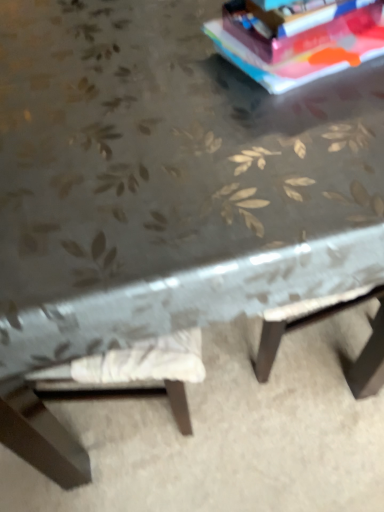
Question: From the image's perspective, is matte paper at upper right under white fabric cushion at lower left?

Choices:
 (A) yes
 (B) no

Answer: (B)

Question: Is matte paper at upper right smaller than white fabric cushion at lower left?

Choices:
 (A) no
 (B) yes

Answer: (B)

Question: Does matte paper at upper right lie in front of white fabric cushion at lower left?

Choices:
 (A) yes
 (B) no

Answer: (A)

Question: Does matte paper at upper right turn towards white fabric cushion at lower left?

Choices:
 (A) no
 (B) yes

Answer: (A)

Question: Considering the relative sizes of matte paper at upper right and white fabric cushion at lower left in the image provided, is matte paper at upper right taller than white fabric cushion at lower left?

Choices:
 (A) no
 (B) yes

Answer: (B)

Question: Considering the relative positions of matte paper at upper right and white fabric cushion at lower left in the image provided, is matte paper at upper right behind white fabric cushion at lower left?

Choices:
 (A) yes
 (B) no

Answer: (B)

Question: Is white fabric cushion at lower left wider than matte paper at upper right?

Choices:
 (A) yes
 (B) no

Answer: (A)

Question: Does white fabric cushion at lower left appear on the right side of matte paper at upper right?

Choices:
 (A) yes
 (B) no

Answer: (B)

Question: Does white fabric cushion at lower left have a smaller size compared to matte paper at upper right?

Choices:
 (A) no
 (B) yes

Answer: (A)

Question: Are white fabric cushion at lower left and matte paper at upper right beside each other?

Choices:
 (A) no
 (B) yes

Answer: (A)

Question: Is white fabric cushion at lower left to the left of matte paper at upper right from the viewer's perspective?

Choices:
 (A) yes
 (B) no

Answer: (A)

Question: Does white fabric cushion at lower left lie behind matte paper at upper right?

Choices:
 (A) no
 (B) yes

Answer: (B)

Question: From the image's perspective, is matte paper at upper right positioned above or below white fabric cushion at lower left?

Choices:
 (A) above
 (B) below

Answer: (A)